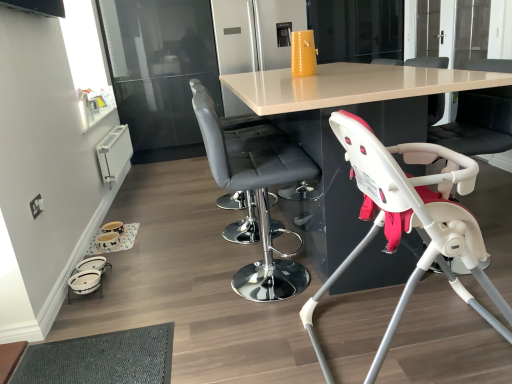
Question: Can you confirm if matte white table at center is wider than black leather chair at right, the fourth chair positioned from the left?

Choices:
 (A) yes
 (B) no

Answer: (A)

Question: Is matte white table at center oriented towards black leather chair at right, the fourth chair from the front?

Choices:
 (A) no
 (B) yes

Answer: (B)

Question: Is matte white table at center far from black leather chair at right, the fourth chair from the front?

Choices:
 (A) yes
 (B) no

Answer: (B)

Question: Can you confirm if matte white table at center is positioned to the left of black leather chair at right, the fourth chair from the front?

Choices:
 (A) yes
 (B) no

Answer: (A)

Question: From the image's perspective, is matte white table at center located above black leather chair at right, the fourth chair from the front?

Choices:
 (A) yes
 (B) no

Answer: (B)

Question: Is matte white table at center closer to camera compared to black leather chair at right, the fourth chair positioned from the left?

Choices:
 (A) yes
 (B) no

Answer: (A)

Question: Is white plastic highchair at lower right, acting as the 2th chair starting from the right, thinner than white plastic baby carriage at lower left?

Choices:
 (A) no
 (B) yes

Answer: (A)

Question: Is white plastic highchair at lower right, acting as the 1th chair starting from the front, facing away from white plastic baby carriage at lower left?

Choices:
 (A) no
 (B) yes

Answer: (A)

Question: Is white plastic baby carriage at lower left surrounded by white plastic highchair at lower right, the 4th chair viewed from the back?

Choices:
 (A) no
 (B) yes

Answer: (A)

Question: From a real-world perspective, is white plastic highchair at lower right, acting as the 1th chair starting from the front, over white plastic baby carriage at lower left?

Choices:
 (A) yes
 (B) no

Answer: (A)

Question: Does white plastic highchair at lower right, the 4th chair viewed from the back, appear on the left side of white plastic baby carriage at lower left?

Choices:
 (A) no
 (B) yes

Answer: (A)

Question: From the image's perspective, would you say matte white table at center is shown under white plastic baby carriage at lower left?

Choices:
 (A) yes
 (B) no

Answer: (B)